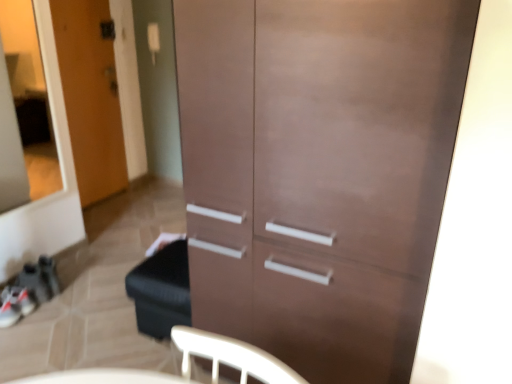
Question: Considering the positions of point (466, 49) and point (53, 114), is point (466, 49) closer or farther from the camera than point (53, 114)?

Choices:
 (A) closer
 (B) farther

Answer: (A)

Question: From a real-world perspective, relative to transparent glass door at upper left, is matte brown cabinet at center vertically above or below?

Choices:
 (A) above
 (B) below

Answer: (B)

Question: Based on their relative distances, which object is farther from the transparent glass door at upper left?

Choices:
 (A) wooden door at left
 (B) matte brown cabinet at center

Answer: (B)

Question: Based on their relative distances, which object is farther from the transparent glass door at upper left?

Choices:
 (A) wooden door at left
 (B) matte brown cabinet at center

Answer: (B)